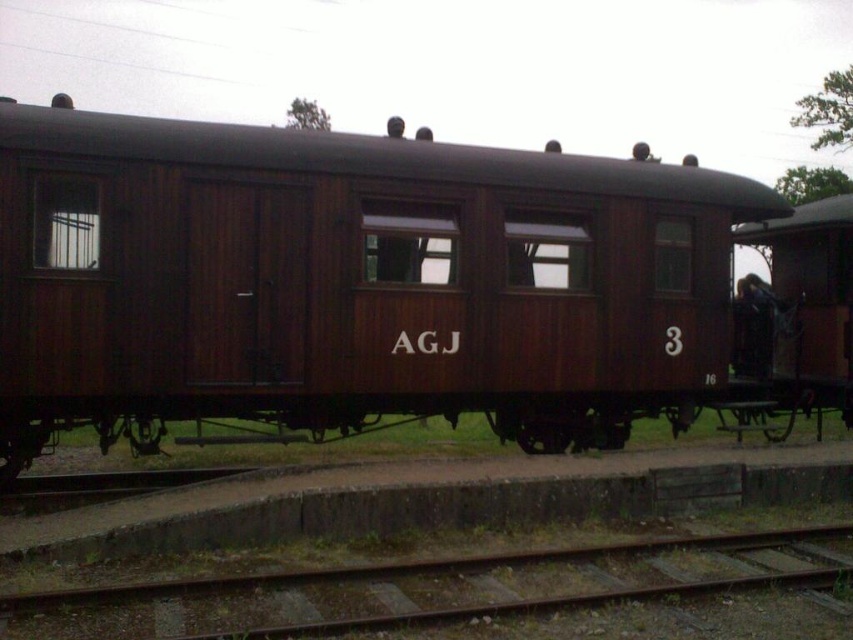
Question: Can you confirm if wooden train car at center is smaller than rusty metal train track at lower center?

Choices:
 (A) no
 (B) yes

Answer: (A)

Question: Does wooden train car at center have a lesser width compared to rusty metal train track at lower center?

Choices:
 (A) no
 (B) yes

Answer: (A)

Question: Which point is closer to the camera?

Choices:
 (A) (584, 592)
 (B) (447, 148)

Answer: (A)

Question: Is wooden train car at center wider than rusty metal train track at lower center?

Choices:
 (A) yes
 (B) no

Answer: (A)

Question: Which point appears closest to the camera in this image?

Choices:
 (A) (80, 353)
 (B) (265, 600)

Answer: (B)